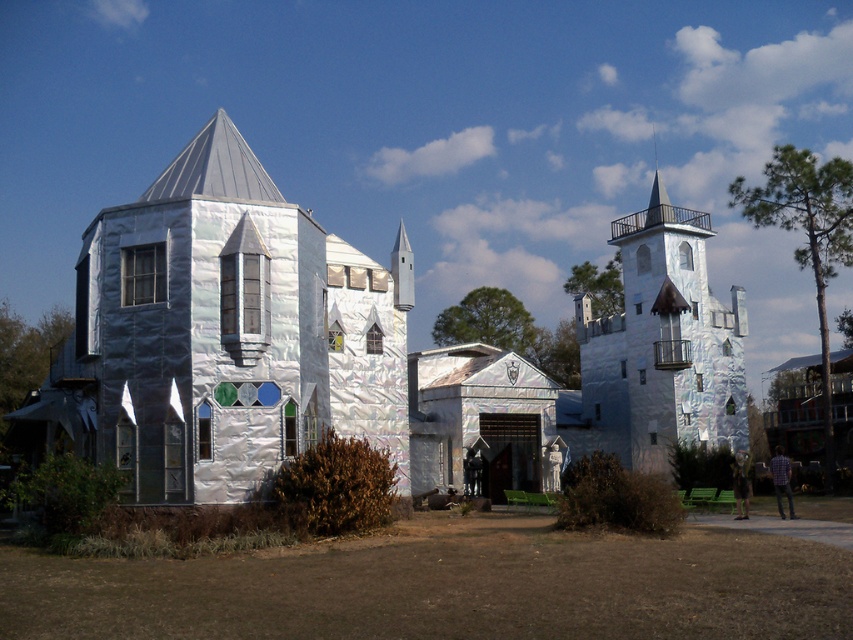
Between silver foil castle at center and shiny silver castle at upper right, which one has more height?

shiny silver castle at upper right is taller.

How far apart are silver foil castle at center and shiny silver castle at upper right?

silver foil castle at center and shiny silver castle at upper right are 6.32 meters apart.

Describe the element at coordinates (361, 349) in the screenshot. I see `silver foil castle at center` at that location.

Identify the location of silver foil castle at center. The height and width of the screenshot is (640, 853). (361, 349).